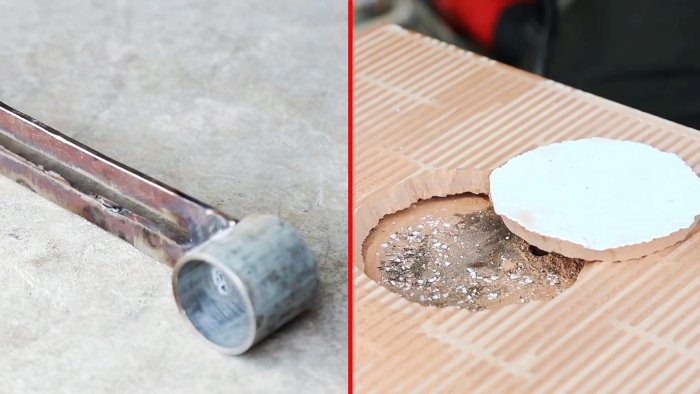
Identify the location of surface. Image resolution: width=700 pixels, height=394 pixels. (66, 322).